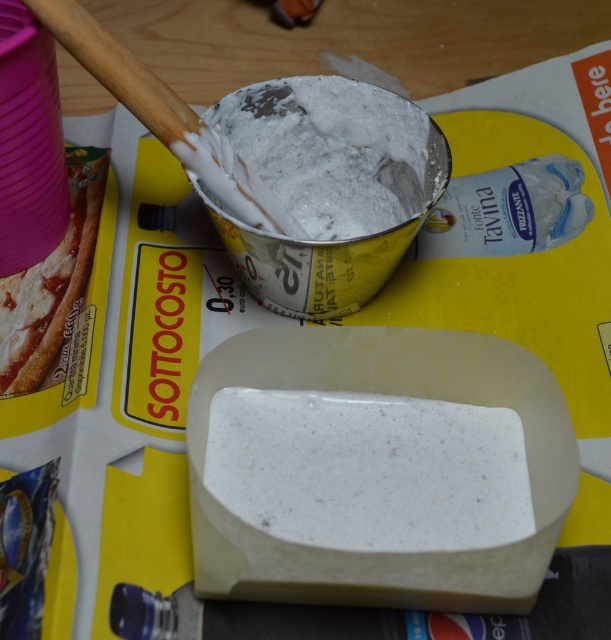
Does white speckled soap at center have a larger size compared to matte cardboard pizza at upper left?

Correct, white speckled soap at center is larger in size than matte cardboard pizza at upper left.

Can you confirm if white speckled soap at center is wider than matte cardboard pizza at upper left?

Indeed, white speckled soap at center has a greater width compared to matte cardboard pizza at upper left.

Image resolution: width=611 pixels, height=640 pixels. Describe the element at coordinates (331, 150) in the screenshot. I see `white speckled soap at center` at that location.

Where is `white speckled soap at center`? white speckled soap at center is located at coordinates (331, 150).